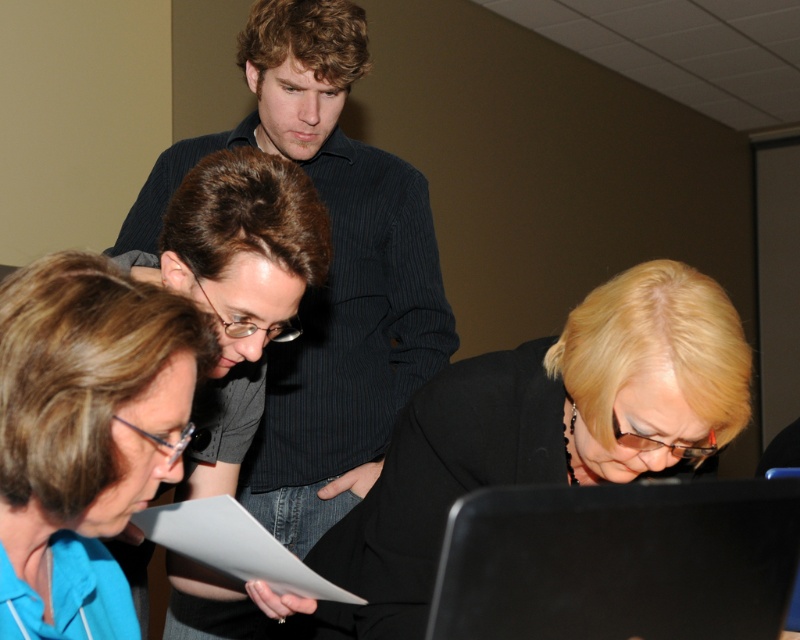
Consider the image. You are standing in the room and want to hand a document to the person wearing the black matte jacket at lower center without disturbing the person using the black matte laptop at lower right. Which direction should you move to approach the jacket wearer?

You should move to the left to approach the person wearing the black matte jacket at lower center since it is to the left of the black matte laptop at lower right, allowing you to reach them without interfering with the laptop user.

You are standing in the room and want to see the laptop screen clearly. Which of the two people, the dark blue striped shirt at upper center or the blue fabric shirt at lower left, is blocking your view more?

The blue fabric shirt at lower left is behind dark blue striped shirt at upper center, so the dark blue striped shirt at upper center is blocking your view more.